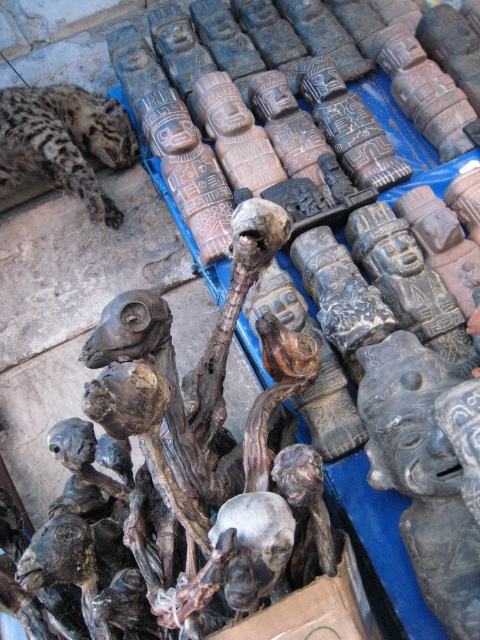
Question: Is brown wood skull at center in front of spotted fur cheetah at upper left?

Choices:
 (A) yes
 (B) no

Answer: (A)

Question: Where is brown wood skull at center located in relation to spotted fur cheetah at upper left in the image?

Choices:
 (A) left
 (B) right

Answer: (B)

Question: Can you confirm if brown wood skull at center is smaller than spotted fur cheetah at upper left?

Choices:
 (A) yes
 (B) no

Answer: (B)

Question: Which point is farther from the camera taking this photo?

Choices:
 (A) (84, 412)
 (B) (52, 92)

Answer: (B)

Question: Which object is farther from the camera taking this photo?

Choices:
 (A) spotted fur cheetah at upper left
 (B) brown wood skull at center

Answer: (A)

Question: Among these points, which one is nearest to the camera?

Choices:
 (A) (40, 100)
 (B) (88, 541)

Answer: (B)